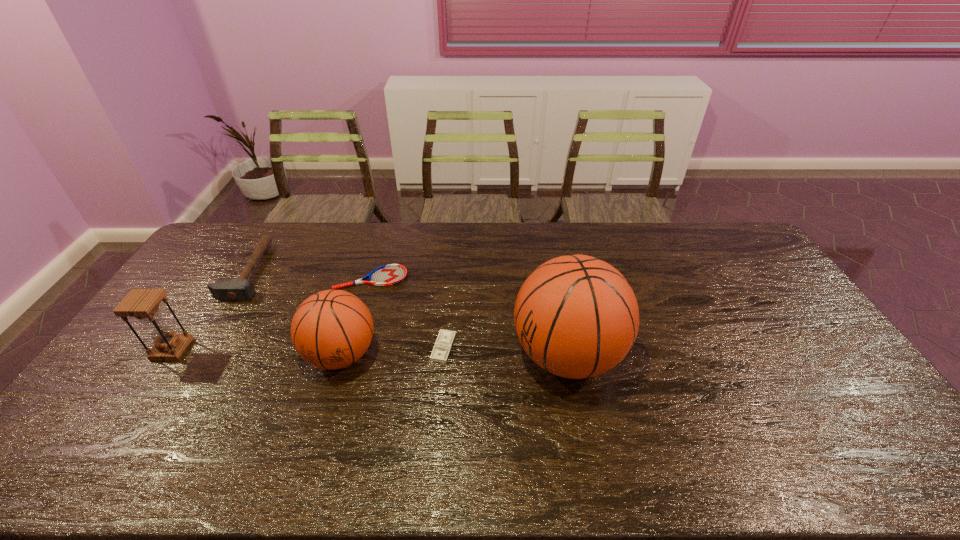
The width and height of the screenshot is (960, 540). Identify the location of free spot that satisfies the following two spatial constraints: 1. on the striking surface of the third shortest object; 2. on the left side of the rightmost object. (199, 356).